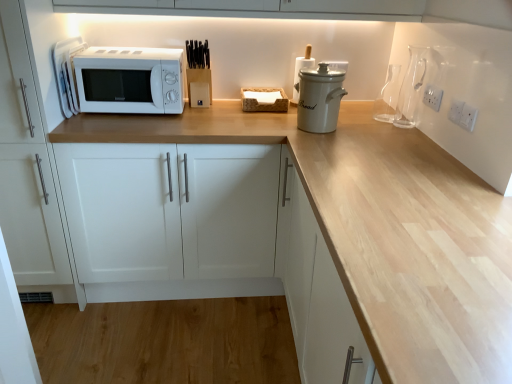
Identify the location of free space on the front side of white matte microwave at upper left, marked as the 1th appliance in a left-to-right arrangement. The height and width of the screenshot is (384, 512). (81, 117).